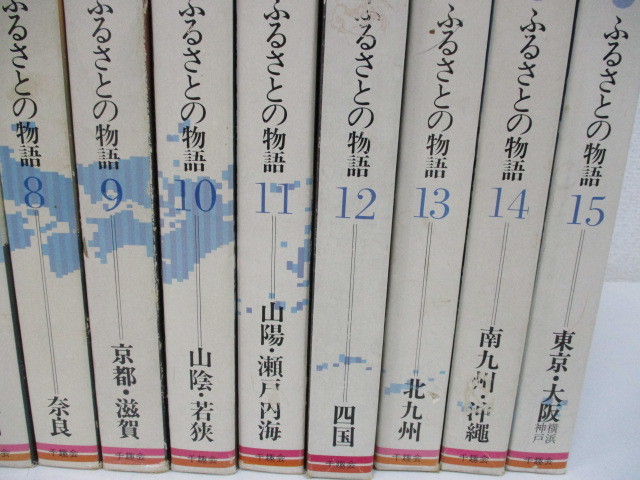
You are a GUI agent. You are given a task and a screenshot of the screen. Output one action in this format:
    pyautogui.click(x=<x>, y=<y>)
    Task: Click on the book 15
    
    Given the screenshot: What is the action you would take?
    pyautogui.click(x=566, y=285)